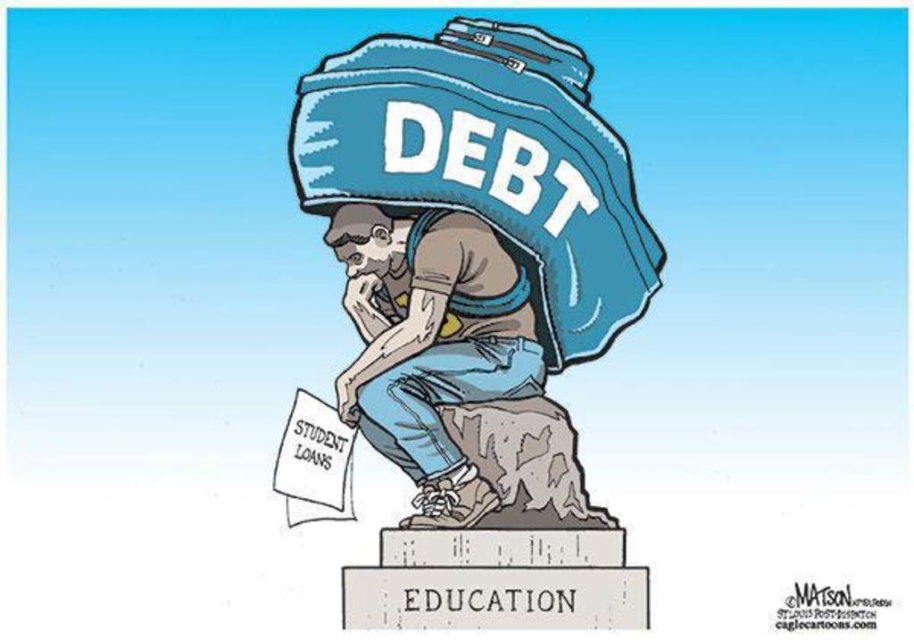
You are an art student analyzing the political cartoon. You notice the blue fabric bag at center and the brown skin tone at center. Which object is closer to you in the image?

The blue fabric bag at center is closer to you than the brown skin tone at center.

In the political cartoon, where is the blue fabric bag at center positioned relative to the figure sitting on the pedestal labeled EDUCATION?

The blue fabric bag at center is positioned at the coordinates point (x=471, y=252) relative to the figure sitting on the pedestal labeled EDUCATION.